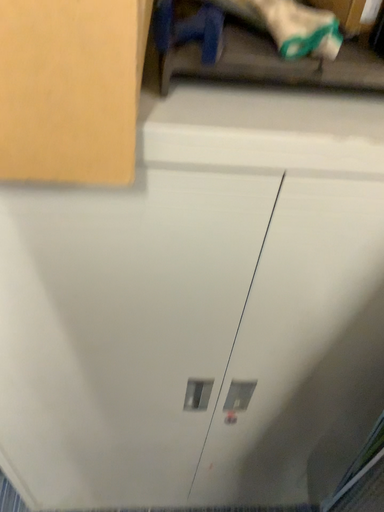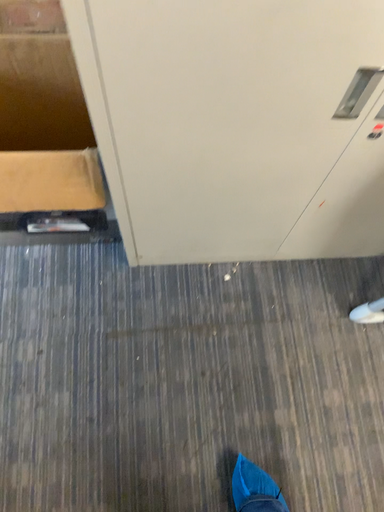
Question: How did the camera likely rotate when shooting the video?

Choices:
 (A) rotated upward
 (B) rotated downward

Answer: (B)